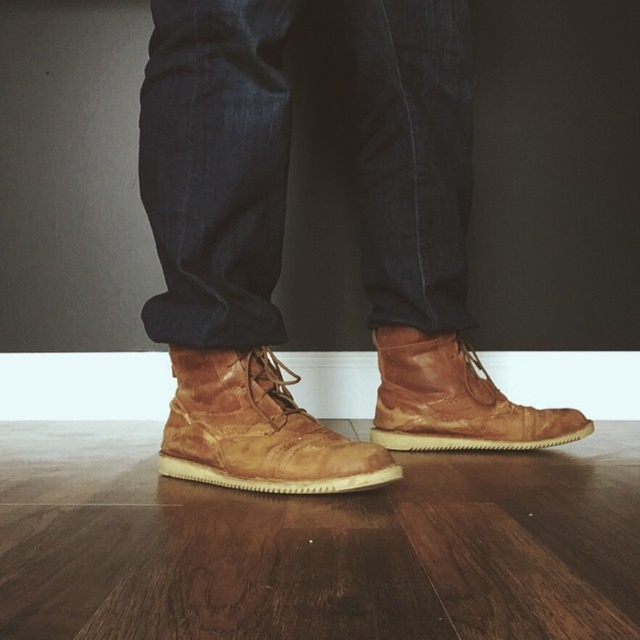
Can you confirm if dark blue denim jeans at center is shorter than leather boot at center?

Incorrect, dark blue denim jeans at center's height does not fall short of leather boot at center's.

Is point (177, 324) positioned before point (211, 452)?

That is False.

This screenshot has height=640, width=640. In order to click on dark blue denim jeans at center in this screenshot , I will do `click(216, 170)`.

Is leather boot at center shorter than leather boot at lower right?

Yes.

Which is more to the right, leather boot at center or leather boot at lower right?

leather boot at lower right

Describe the element at coordinates (257, 429) in the screenshot. I see `leather boot at center` at that location.

This screenshot has height=640, width=640. Find the location of `leather boot at center`. leather boot at center is located at coordinates (257, 429).

Does point (449, 20) come farther from viewer compared to point (417, 381)?

No, it is in front of (417, 381).

What are the coordinates of `dark blue denim jeans at center` in the screenshot? It's located at (216, 170).

Image resolution: width=640 pixels, height=640 pixels. In order to click on dark blue denim jeans at center in this screenshot , I will do `click(216, 170)`.